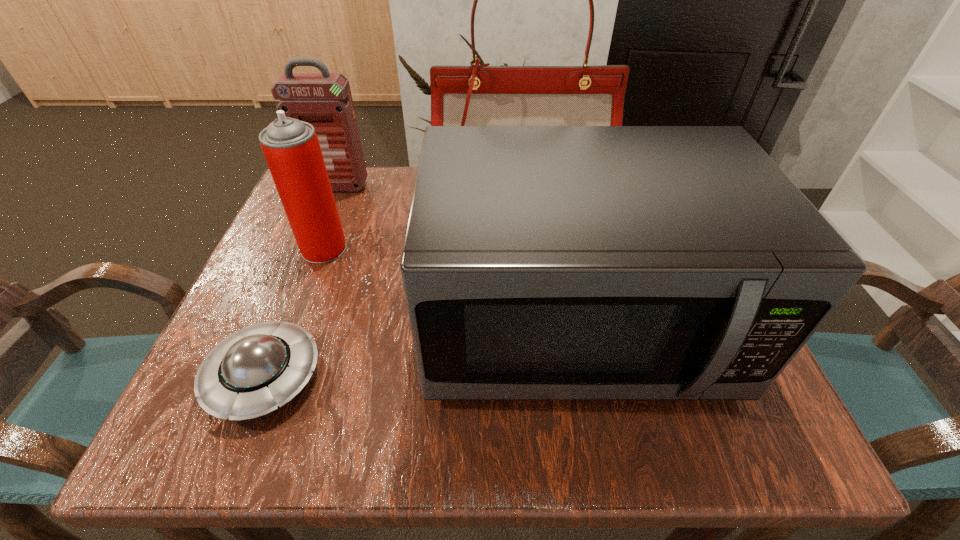
Find the location of a particular element. The width and height of the screenshot is (960, 540). the first-aid kit that is at the far edge is located at coordinates (324, 100).

Image resolution: width=960 pixels, height=540 pixels. In order to click on microwave oven that is at the near edge in this screenshot , I will do `click(540, 262)`.

At what (x,y) coordinates should I click in order to perform the action: click on saucer that is at the near edge. Please return your answer as a coordinate pair (x, y). This screenshot has width=960, height=540. Looking at the image, I should click on (250, 373).

Where is `the first-aid kit that is at the left edge`? This screenshot has height=540, width=960. the first-aid kit that is at the left edge is located at coordinates [324, 100].

At what (x,y) coordinates should I click in order to perform the action: click on aerosol can that is at the left edge. Please return your answer as a coordinate pair (x, y). Looking at the image, I should click on (291, 147).

Image resolution: width=960 pixels, height=540 pixels. I want to click on saucer present at the left edge, so click(x=250, y=373).

Where is `handbag positioned at the right edge`? Image resolution: width=960 pixels, height=540 pixels. handbag positioned at the right edge is located at coordinates (478, 95).

Find the location of a particular element. Image resolution: width=960 pixels, height=540 pixels. microwave oven that is at the right edge is located at coordinates (540, 262).

The width and height of the screenshot is (960, 540). Identify the location of object that is at the far left corner. (324, 100).

This screenshot has height=540, width=960. I want to click on object present at the near left corner, so click(250, 373).